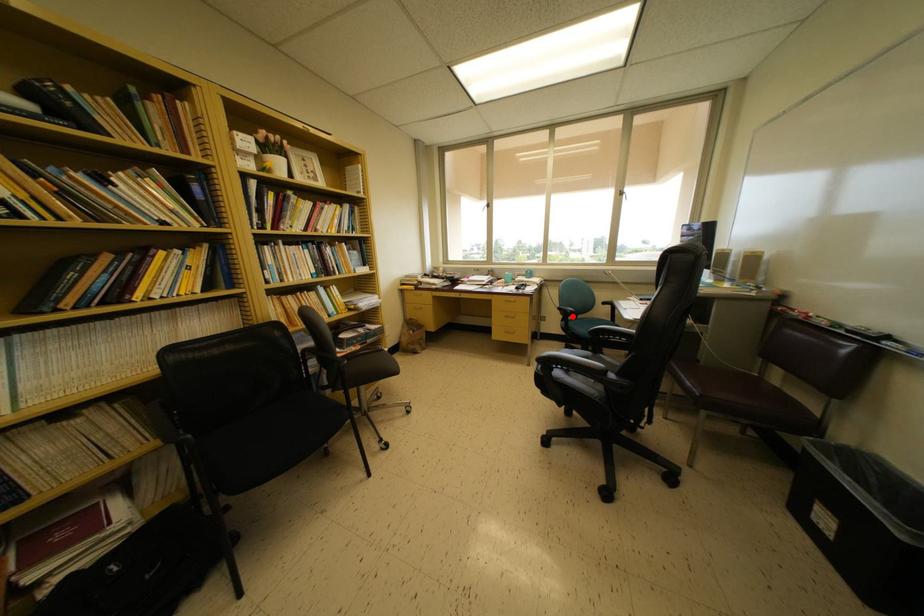
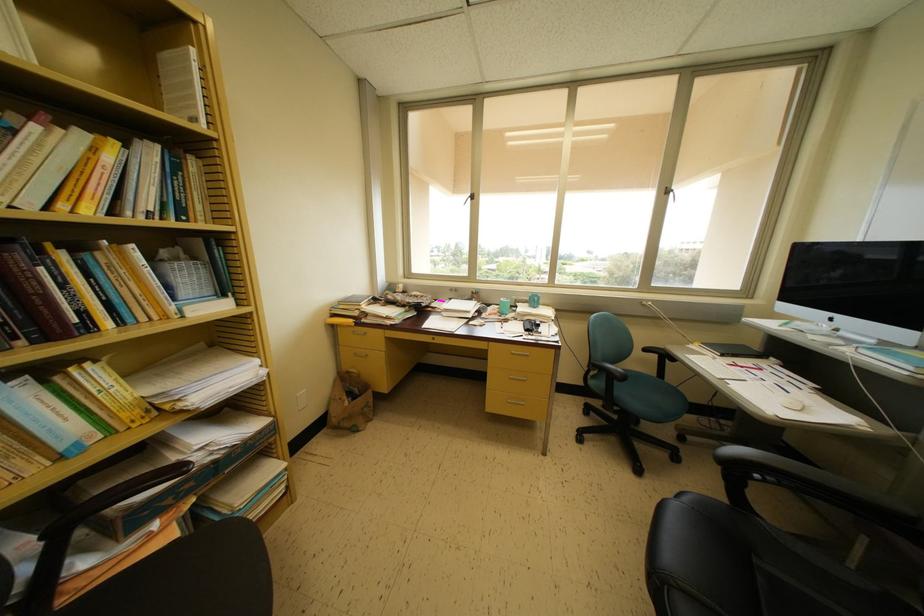
Where in the second image is the point corresponding to the highlighted location from the first image?

(622, 379)